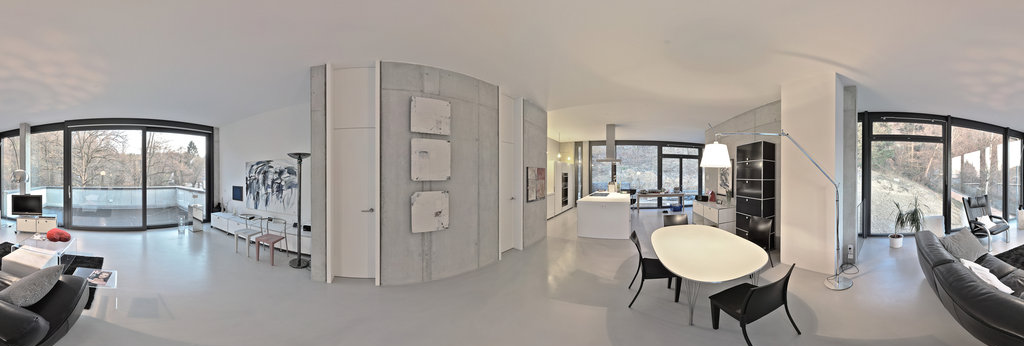
Identify the location of counter. The image size is (1024, 346). (617, 214).